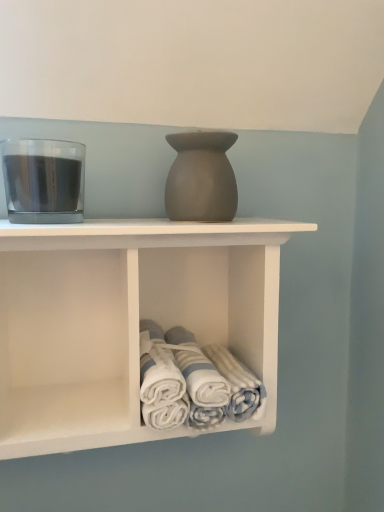
Question: Are white cotton towels at lower center and transparent glass at left beside each other?

Choices:
 (A) yes
 (B) no

Answer: (B)

Question: Does white cotton towels at lower center lie in front of transparent glass at left?

Choices:
 (A) yes
 (B) no

Answer: (B)

Question: Is white cotton towels at lower center far from transparent glass at left?

Choices:
 (A) no
 (B) yes

Answer: (A)

Question: From the image's perspective, would you say white cotton towels at lower center is shown under transparent glass at left?

Choices:
 (A) no
 (B) yes

Answer: (B)

Question: Considering the relative sizes of white cotton towels at lower center and transparent glass at left in the image provided, is white cotton towels at lower center thinner than transparent glass at left?

Choices:
 (A) yes
 (B) no

Answer: (B)

Question: Visually, is white cotton towels at lower center positioned to the left or to the right of transparent glass at left?

Choices:
 (A) right
 (B) left

Answer: (A)

Question: From a real-world perspective, is white cotton towels at lower center positioned above or below transparent glass at left?

Choices:
 (A) below
 (B) above

Answer: (A)

Question: Is point (142, 378) closer or farther from the camera than point (51, 202)?

Choices:
 (A) farther
 (B) closer

Answer: (A)

Question: Is white cotton towels at lower center inside the boundaries of transparent glass at left, or outside?

Choices:
 (A) inside
 (B) outside

Answer: (B)

Question: Is point (31, 156) positioned closer to the camera than point (190, 132)?

Choices:
 (A) farther
 (B) closer

Answer: (B)

Question: Would you say transparent glass at left is to the left or to the right of matte gray vase at center in the picture?

Choices:
 (A) right
 (B) left

Answer: (B)

Question: Relative to matte gray vase at center, is transparent glass at left in front or behind?

Choices:
 (A) front
 (B) behind

Answer: (A)

Question: Looking at the image, does transparent glass at left seem bigger or smaller compared to matte gray vase at center?

Choices:
 (A) small
 (B) big

Answer: (B)

Question: Is white matte towel rack at center situated inside transparent glass at left or outside?

Choices:
 (A) inside
 (B) outside

Answer: (B)

Question: Is white matte towel rack at center in front of or behind transparent glass at left in the image?

Choices:
 (A) front
 (B) behind

Answer: (A)